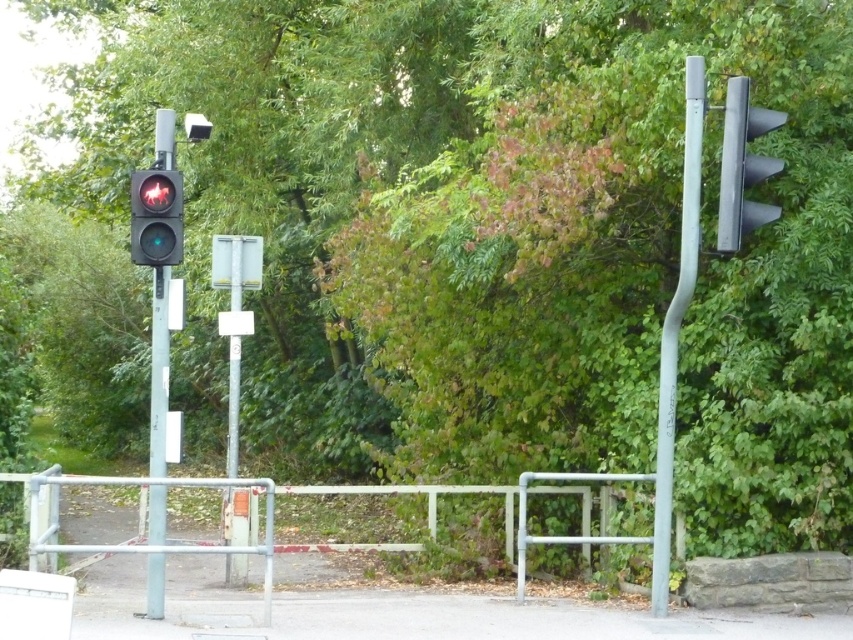
You are a pedestrian approaching the traffic signal setup. You need to cross the road and must determine which direction to look first. Based on the scene, which object should you check first, the metallic pole at left or the metallic gray traffic light at right?

You should check the metallic gray traffic light at right first because it is the one that is illuminated with a red light, indicating a stop for vehicles, while the other pole is unlit. Since traffic lights provide active traffic signals, prioritizing the metallic gray traffic light at right ensures you are aware of the current traffic control signals.

You are a delivery driver with a truck that is 3 meters wide. You need to pass through the gap between the metallic pole at left and the metallic gray traffic light at right. Can your truck fit through the gap?

The gap between the metallic pole at left and the metallic gray traffic light at right is 3.89 meters. Since the truck is 3 meters wide, it can fit through the gap as the width of the gap is greater than the truck.